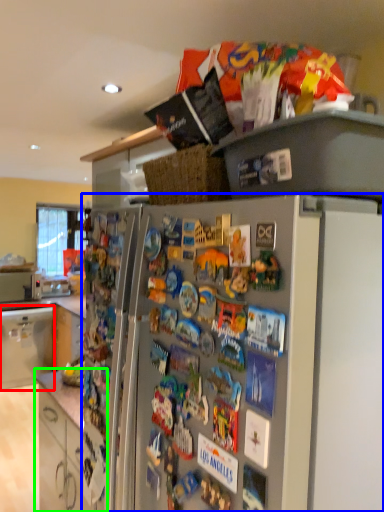
Question: Which object is the closest to the cabinetry (highlighted by a red box)? Choose among these: refrigerator (highlighted by a blue box) or cabinetry (highlighted by a green box).

Choices:
 (A) refrigerator
 (B) cabinetry

Answer: (B)